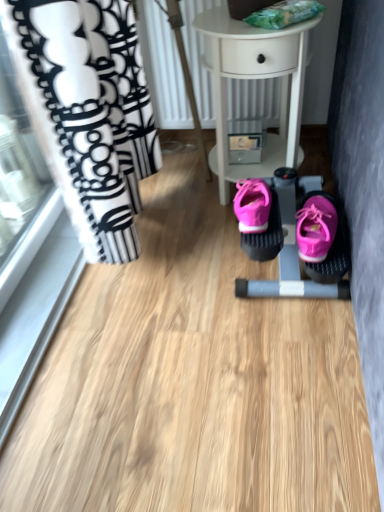
Question: From the image's perspective, is white glossy table at center located above or below pink fabric baby carriage at center?

Choices:
 (A) above
 (B) below

Answer: (A)

Question: Do you think white glossy table at center is within pink fabric baby carriage at center, or outside of it?

Choices:
 (A) inside
 (B) outside

Answer: (B)

Question: Based on their relative distances, which object is farther from the pink fabric baby carriage at center?

Choices:
 (A) pink suede shoe at center
 (B) white glossy table at center

Answer: (B)

Question: Which object is positioned closest to the pink fabric baby carriage at center?

Choices:
 (A) pink suede shoe at center
 (B) white glossy table at center

Answer: (A)